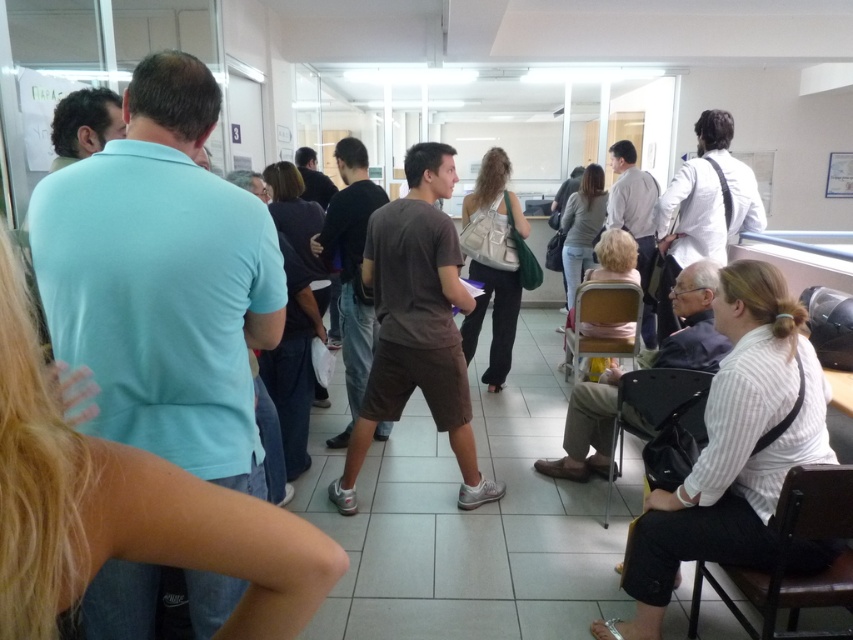
You are standing at the origin point of the coordinate system in this scene. You need to move towards the point at (811,508). However, there is an obstacle at point (335,484). Will you be able to reach your destination without going around the obstacle?

Since point (335,484) is behind point (811,508), you can reach the destination without going around the obstacle.